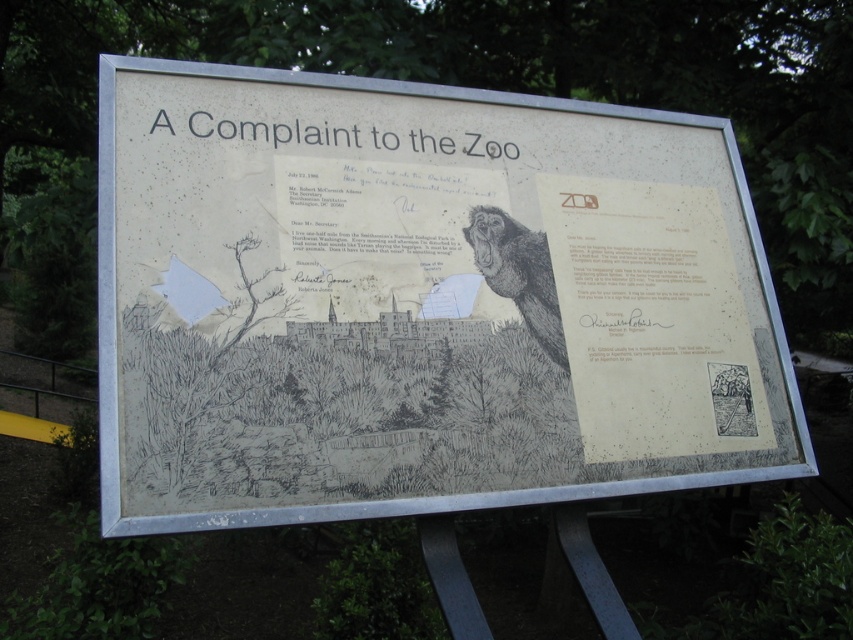
Is white paper sign at center thinner than black paper at upper center?

Incorrect, white paper sign at center's width is not less than black paper at upper center's.

Can you confirm if white paper sign at center is positioned to the right of black paper at upper center?

Correct, you'll find white paper sign at center to the right of black paper at upper center.

Between point (302, 116) and point (373, 140), which one is positioned in front?

Point (302, 116) is more forward.

This screenshot has height=640, width=853. Identify the location of white paper sign at center. (421, 301).